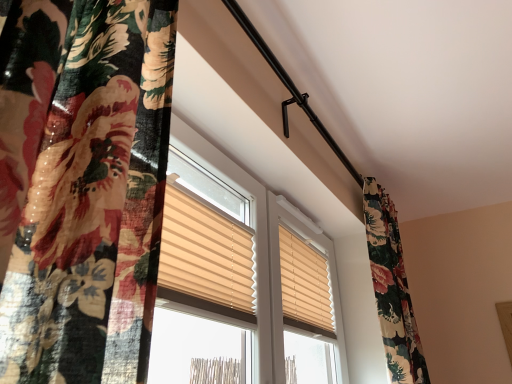
Describe the element at coordinates (305, 285) in the screenshot. Image resolution: width=512 pixels, height=384 pixels. I see `beige fabric window blind at center` at that location.

Identify the location of beige fabric window blind at center. (305, 285).

Locate an element on the screen. floral fabric curtain at left is located at coordinates (82, 186).

What do you see at coordinates (82, 186) in the screenshot? I see `floral fabric curtain at left` at bounding box center [82, 186].

Locate an element on the screen. beige fabric window blind at center is located at coordinates (305, 285).

Which is more to the right, beige fabric window blind at center or floral fabric curtain at left?

From the viewer's perspective, beige fabric window blind at center appears more on the right side.

Which is behind, beige fabric window blind at center or floral fabric curtain at left?

Positioned behind is beige fabric window blind at center.

Considering the positions of points (282, 230) and (116, 232), is point (282, 230) farther from camera compared to point (116, 232)?

Yes, point (282, 230) is farther from viewer.

From the image's perspective, which one is positioned lower, beige fabric window blind at center or floral fabric curtain at left?

beige fabric window blind at center, from the image's perspective.

From the picture: From a real-world perspective, is beige fabric window blind at center above or below floral fabric curtain at left?

Clearly, from a real-world perspective, beige fabric window blind at center is above floral fabric curtain at left.

Considering the sizes of objects beige fabric window blind at center and floral fabric curtain at left in the image provided, who is thinner, beige fabric window blind at center or floral fabric curtain at left?

beige fabric window blind at center is thinner.

From their relative heights in the image, would you say beige fabric window blind at center is taller or shorter than floral fabric curtain at left?

Considering their sizes, beige fabric window blind at center has less height than floral fabric curtain at left.

From the picture: Can you confirm if beige fabric window blind at center is smaller than floral fabric curtain at left?

Correct, beige fabric window blind at center occupies less space than floral fabric curtain at left.

Is floral fabric curtain at left completely or partially inside beige fabric window blind at center?

No, floral fabric curtain at left is not surrounded by beige fabric window blind at center.

Are beige fabric window blind at center and floral fabric curtain at left located far from each other?

That's right, there is a large distance between beige fabric window blind at center and floral fabric curtain at left.

Does beige fabric window blind at center turn towards floral fabric curtain at left?

Yes, beige fabric window blind at center is aimed at floral fabric curtain at left.

Image resolution: width=512 pixels, height=384 pixels. Identify the location of window blind above the floral fabric curtain at left (from a real-world perspective). coord(305,285).

Between floral fabric curtain at left and beige fabric window blind at center, which one appears on the left side from the viewer's perspective?

floral fabric curtain at left is more to the left.

Considering the positions of objects floral fabric curtain at left and beige fabric window blind at center in the image provided, who is behind, floral fabric curtain at left or beige fabric window blind at center?

Positioned behind is beige fabric window blind at center.

Considering the positions of points (170, 53) and (300, 308), is point (170, 53) closer to camera compared to point (300, 308)?

Yes, point (170, 53) is closer to viewer.

From the image's perspective, which one is positioned lower, floral fabric curtain at left or beige fabric window blind at center?

beige fabric window blind at center, from the image's perspective.

From a real-world perspective, is floral fabric curtain at left positioned above or below beige fabric window blind at center?

Clearly, from a real-world perspective, floral fabric curtain at left is below beige fabric window blind at center.

Does floral fabric curtain at left have a lesser width compared to beige fabric window blind at center?

No, floral fabric curtain at left is not thinner than beige fabric window blind at center.

Considering the relative sizes of floral fabric curtain at left and beige fabric window blind at center in the image provided, is floral fabric curtain at left shorter than beige fabric window blind at center?

No, floral fabric curtain at left is not shorter than beige fabric window blind at center.

Which of these two, floral fabric curtain at left or beige fabric window blind at center, is bigger?

floral fabric curtain at left is bigger.

Is floral fabric curtain at left positioned beyond the bounds of beige fabric window blind at center?

floral fabric curtain at left lies outside beige fabric window blind at center's area.

Is floral fabric curtain at left directly adjacent to beige fabric window blind at center?

floral fabric curtain at left and beige fabric window blind at center are clearly separated.

Is floral fabric curtain at left positioned with its back to beige fabric window blind at center?

Yes, beige fabric window blind at center is at the back of floral fabric curtain at left.

What's the angular difference between floral fabric curtain at left and beige fabric window blind at center's facing directions?

There is a 7.21e-05-degree angle between the facing directions of floral fabric curtain at left and beige fabric window blind at center.

The image size is (512, 384). What are the coordinates of `window blind that is above the floral fabric curtain at left (from a real-world perspective)` in the screenshot? It's located at (305, 285).

Locate an element on the screen. This screenshot has width=512, height=384. window blind located above the floral fabric curtain at left (from a real-world perspective) is located at coordinates (305, 285).

Identify the location of window blind below the floral fabric curtain at left (from the image's perspective). The height and width of the screenshot is (384, 512). (305, 285).